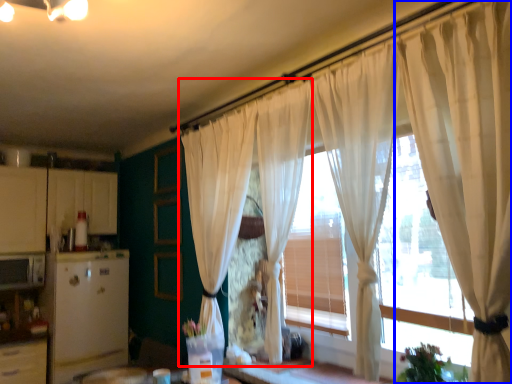
Question: Among these objects, which one is farthest to the camera, curtain (highlighted by a red box) or curtain (highlighted by a blue box)?

Choices:
 (A) curtain
 (B) curtain

Answer: (A)